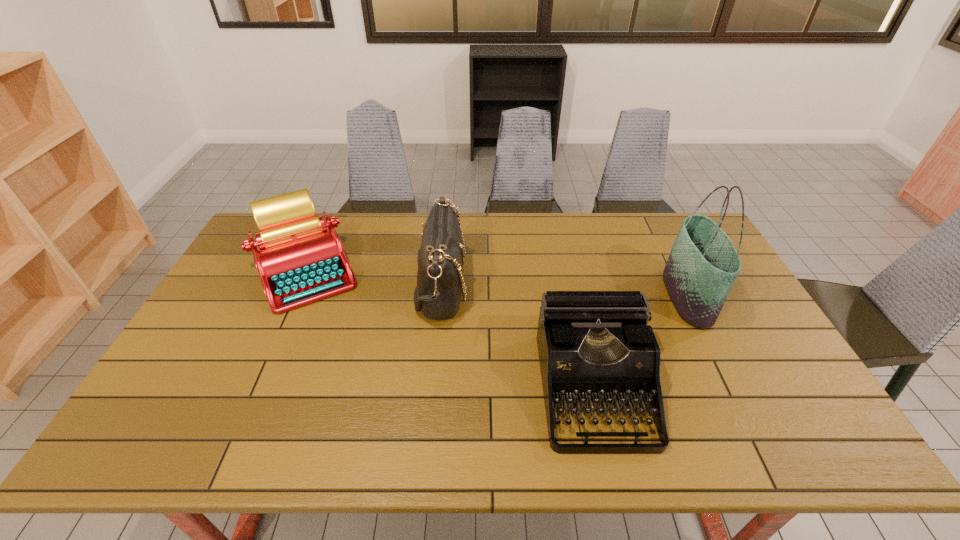
Locate an element on the screen. The width and height of the screenshot is (960, 540). tote bag is located at coordinates (703, 264).

I want to click on the rightmost object, so click(703, 264).

Locate an element on the screen. The height and width of the screenshot is (540, 960). handbag is located at coordinates (440, 260).

The image size is (960, 540). What are the coordinates of `the second object from left to right` in the screenshot? It's located at (440, 260).

Where is `the left typewriter`? the left typewriter is located at coordinates (300, 261).

You are a GUI agent. You are given a task and a screenshot of the screen. Output one action in this format:
    pyautogui.click(x=<x>, y=<y>)
    Task: Click on the farther typewriter
    
    Given the screenshot: What is the action you would take?
    pyautogui.click(x=300, y=261)

In order to click on the second object from right to left in this screenshot , I will do `click(594, 346)`.

Locate an element on the screen. The height and width of the screenshot is (540, 960). the nearer typewriter is located at coordinates (594, 346).

Find the location of a particular element. vacant position located 0.250m on the left of the rightmost object is located at coordinates (587, 298).

I want to click on vacant space located 0.140m at the front of the third shortest object with chain and zipper, so click(513, 286).